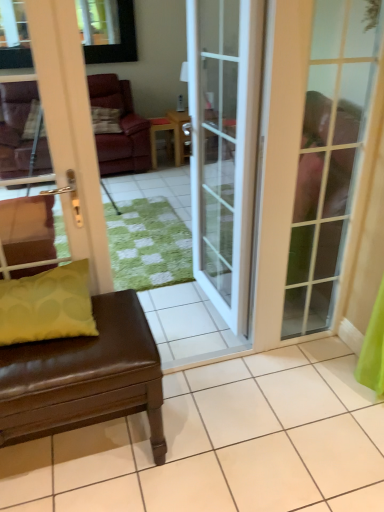
Question: Is point (177, 148) positioned closer to the camera than point (19, 181)?

Choices:
 (A) closer
 (B) farther

Answer: (B)

Question: Considering the relative positions of wooden side table at center and white glossy door at left, the third door viewed from the right, in the image provided, is wooden side table at center to the left or to the right of white glossy door at left, the third door viewed from the right,?

Choices:
 (A) left
 (B) right

Answer: (B)

Question: Which is nearer to the white glossy door at left, the third door viewed from the right?

Choices:
 (A) white glass door at center, the 2th door when ordered from right to left
 (B) brown leather studio couch at left
 (C) matte glass door at right, which appears as the third door when viewed from the left
 (D) wooden side table at center
 (E) matte yellow pillow at lower left

Answer: (E)

Question: Which of these objects is positioned farthest from the matte yellow pillow at lower left?

Choices:
 (A) white glass door at center, the second door viewed from the left
 (B) white glossy door at left, the third door viewed from the right
 (C) brown leather studio couch at left
 (D) wooden side table at center
 (E) matte glass door at right, positioned as the first door in right-to-left order

Answer: (D)